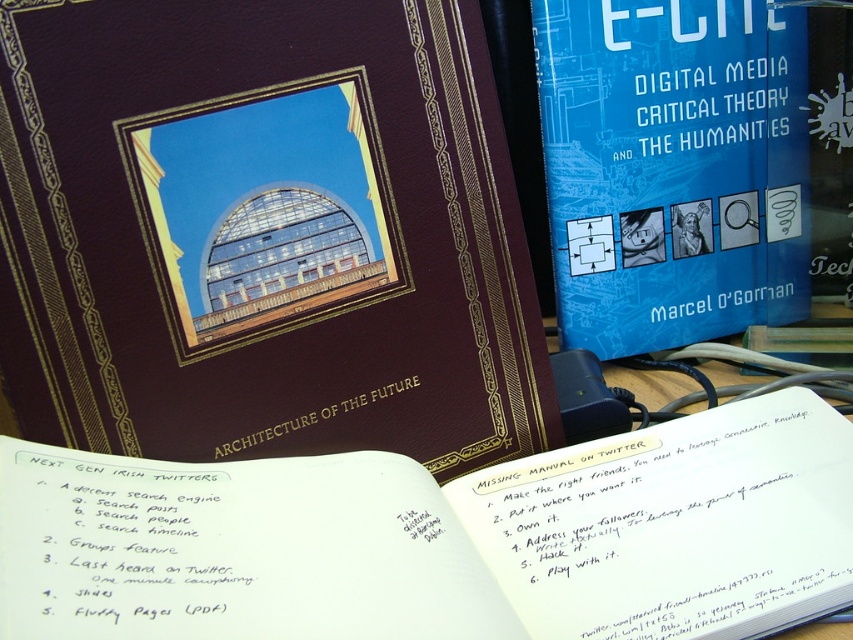
Question: Is matte brown book at center wider than white paper at center?

Choices:
 (A) no
 (B) yes

Answer: (A)

Question: Which point is closer to the camera?

Choices:
 (A) white paper at center
 (B) matte brown book at center

Answer: (A)

Question: Which of the following is the closest to the observer?

Choices:
 (A) white paper at center
 (B) matte brown book at center
 (C) blue paper at upper right

Answer: (A)

Question: Which object is positioned closest to the blue paper at upper right?

Choices:
 (A) matte brown book at center
 (B) white paper at center

Answer: (A)

Question: Is matte brown book at center below white paper at center?

Choices:
 (A) no
 (B) yes

Answer: (A)

Question: Is matte brown book at center to the left of blue paper at upper right from the viewer's perspective?

Choices:
 (A) yes
 (B) no

Answer: (A)